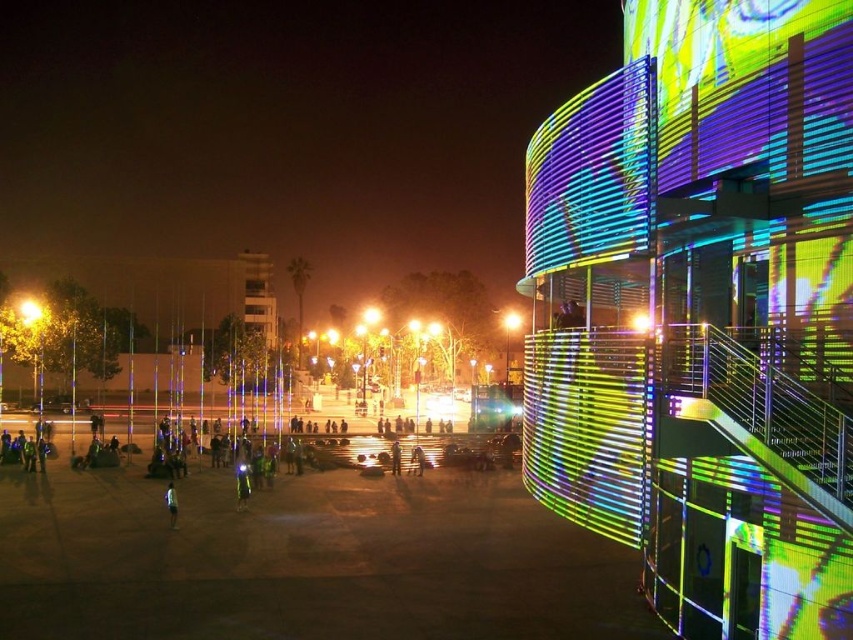
You are a photographer standing in the plaza and want to take a photo of the light blue fabric pants at lower center and the yellow metallic streetlight at center. Based on their positions, which object is closer to the camera?

The light blue fabric pants at lower center is located below the yellow metallic streetlight at center, meaning it is closer to the camera.